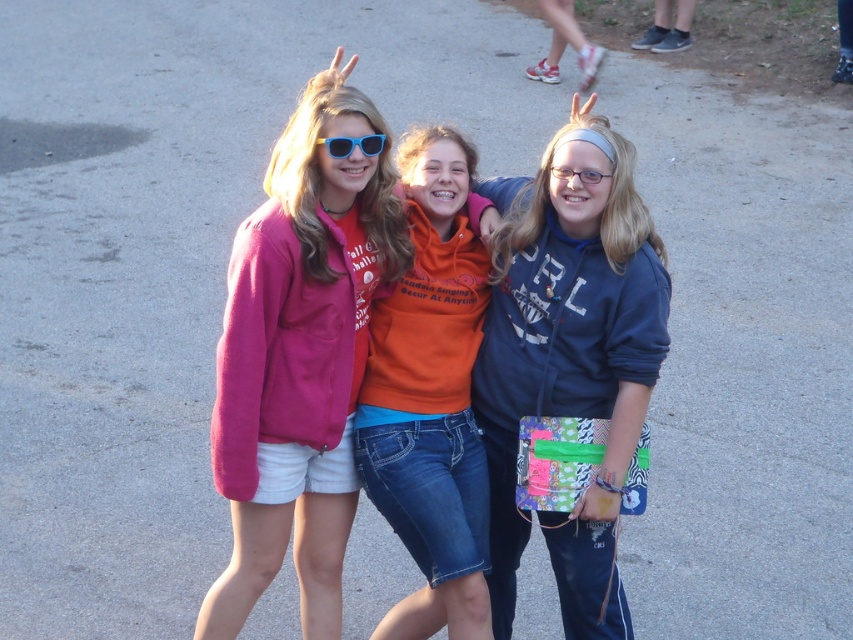
Question: Is matte pink sweatshirt at center below blue plastic sunglasses at center?

Choices:
 (A) yes
 (B) no

Answer: (A)

Question: Which point is farther to the camera?

Choices:
 (A) (351, 148)
 (B) (476, 264)
 (C) (349, 348)

Answer: (B)

Question: Is orange fleece sweatshirt at center closer to the viewer compared to blue plastic sunglasses at center?

Choices:
 (A) no
 (B) yes

Answer: (A)

Question: Which object appears closest to the camera in this image?

Choices:
 (A) matte pink sweatshirt at center
 (B) pink fleece jacket at center
 (C) matte blue hoodie at center

Answer: (A)

Question: Considering the relative positions of orange fleece sweatshirt at center and blue plastic sunglasses at center in the image provided, where is orange fleece sweatshirt at center located with respect to blue plastic sunglasses at center?

Choices:
 (A) left
 (B) right

Answer: (B)

Question: Which of the following is the closest to the observer?

Choices:
 (A) blue plastic sunglasses at center
 (B) matte pink sweatshirt at center
 (C) matte blue hoodie at center
 (D) pink fleece jacket at center

Answer: (B)